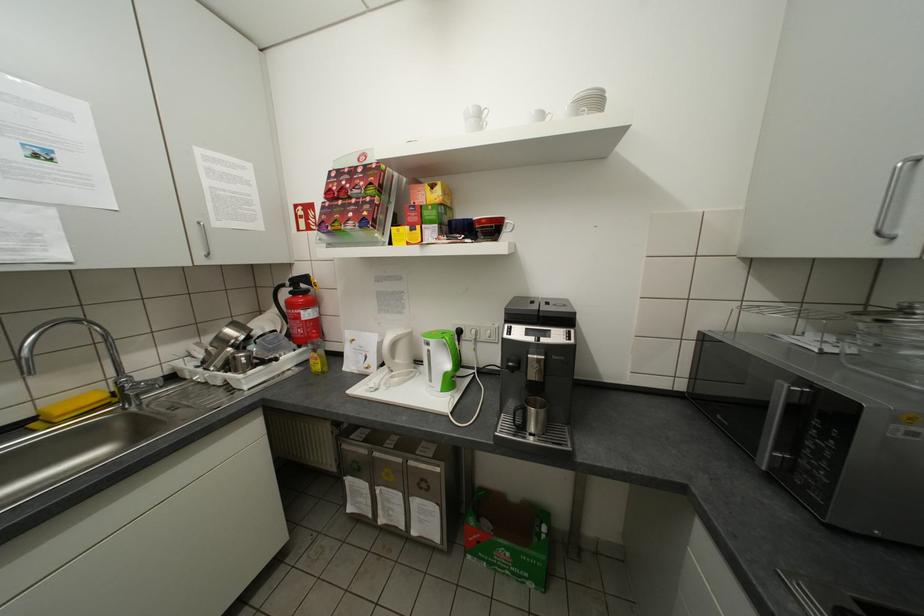
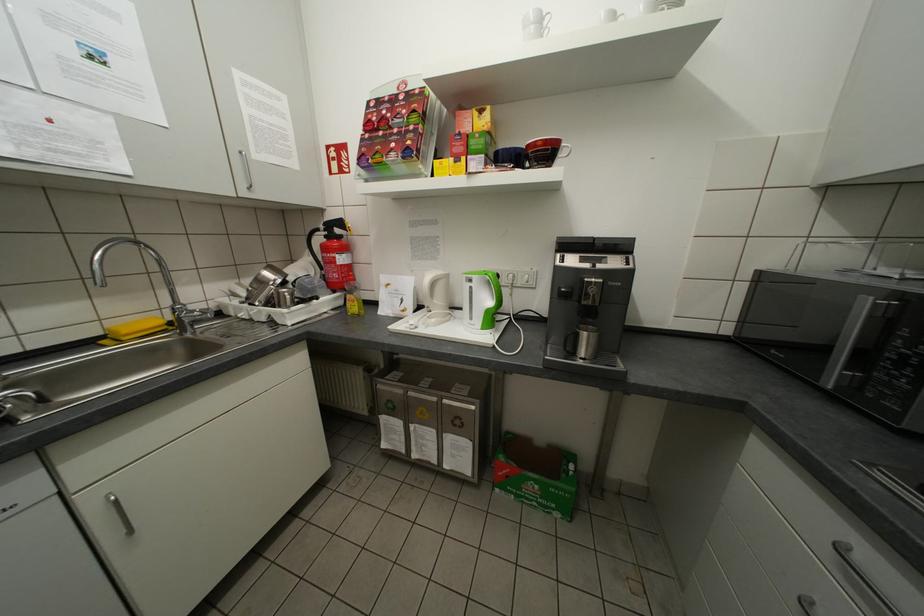
Where in the second image is the point corresponding to point 407,438 from the first image?

(440, 379)